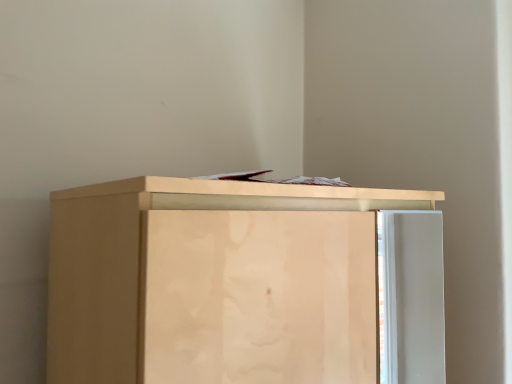
Locate an element on the screen. light wood cabinet at center is located at coordinates (215, 281).

What do you see at coordinates (215, 281) in the screenshot? The width and height of the screenshot is (512, 384). I see `light wood cabinet at center` at bounding box center [215, 281].

Image resolution: width=512 pixels, height=384 pixels. Identify the location of light wood cabinet at center. (215, 281).